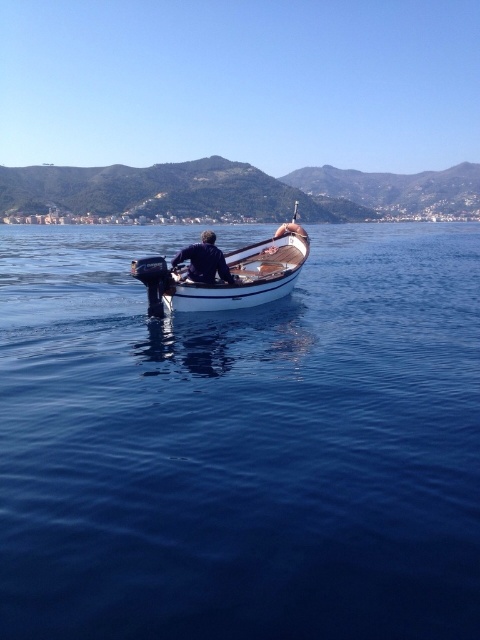
Question: Observing the image, what is the correct spatial positioning of white polished wood boat at center in reference to dark blue fabric at center?

Choices:
 (A) left
 (B) right

Answer: (B)

Question: Can you confirm if blue smooth water at center is bigger than white polished wood boat at center?

Choices:
 (A) no
 (B) yes

Answer: (A)

Question: Estimate the real-world distances between objects in this image. Which object is farther from the blue smooth water at center?

Choices:
 (A) dark blue fabric at center
 (B) white polished wood boat at center

Answer: (A)

Question: Which object is positioned closest to the dark blue fabric at center?

Choices:
 (A) white polished wood boat at center
 (B) blue smooth water at center

Answer: (B)

Question: Does white polished wood boat at center have a smaller size compared to dark blue fabric at center?

Choices:
 (A) no
 (B) yes

Answer: (A)

Question: Estimate the real-world distances between objects in this image. Which object is farther from the white polished wood boat at center?

Choices:
 (A) dark blue fabric at center
 (B) blue smooth water at center

Answer: (A)